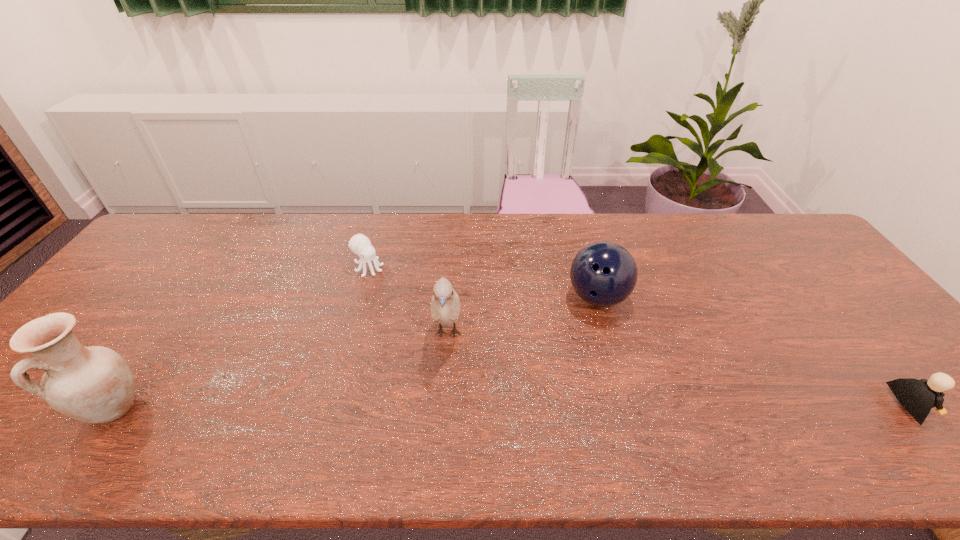
Image resolution: width=960 pixels, height=540 pixels. Find the location of `free region located 0.120m on the surface of the fourth object from left to right near the finger holes`. free region located 0.120m on the surface of the fourth object from left to right near the finger holes is located at coordinates (x=599, y=355).

Identify the location of vacant space located at the beak of the third object from right to left. (445, 396).

Locate an element on the screen. The width and height of the screenshot is (960, 540). vacant space located on the front-facing side of the octopus is located at coordinates (391, 284).

Locate an element on the screen. This screenshot has width=960, height=540. vacant space located 0.070m on the front-facing side of the octopus is located at coordinates (393, 285).

This screenshot has height=540, width=960. I want to click on vacant area located 0.220m on the front-facing side of the octopus, so click(428, 310).

At what (x,y) coordinates should I click in order to perform the action: click on pottery that is at the near edge. Please return your answer as a coordinate pair (x, y). This screenshot has width=960, height=540. Looking at the image, I should click on (94, 384).

Locate an element on the screen. The height and width of the screenshot is (540, 960). Lego that is at the near edge is located at coordinates (918, 397).

Find the location of a particular element. Image resolution: width=960 pixels, height=540 pixels. object that is at the right edge is located at coordinates (918, 397).

I want to click on object that is at the near right corner, so click(918, 397).

In the image, there is a desktop. Where is `vacant space at the far edge`? This screenshot has height=540, width=960. vacant space at the far edge is located at coordinates (669, 220).